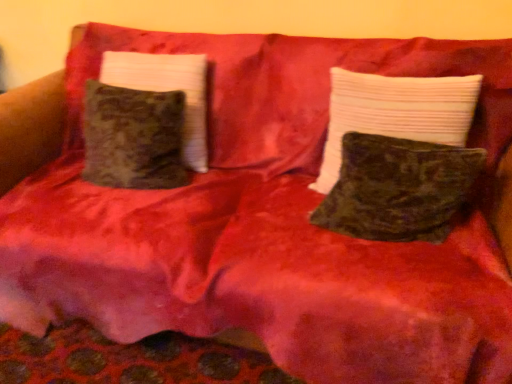
The height and width of the screenshot is (384, 512). Describe the element at coordinates (395, 112) in the screenshot. I see `velvet green pillow at center, the third pillow viewed from the left` at that location.

Image resolution: width=512 pixels, height=384 pixels. What do you see at coordinates (398, 189) in the screenshot?
I see `velvety dark green pillow at center, marked as the second pillow in a left-to-right arrangement` at bounding box center [398, 189].

Where is `velvet green pillow at center, the third pillow viewed from the left`? velvet green pillow at center, the third pillow viewed from the left is located at coordinates (395, 112).

Who is smaller, velvet green pillow at center, the third pillow viewed from the left, or velvet green pillow at left, the first pillow in the left-to-right sequence?

velvet green pillow at center, the third pillow viewed from the left, is smaller.

Can you confirm if velvet green pillow at center, which ranks as the first pillow in right-to-left order, is wider than velvet green pillow at left, the first pillow in the left-to-right sequence?

Incorrect, the width of velvet green pillow at center, which ranks as the first pillow in right-to-left order, does not surpass that of velvet green pillow at left, the first pillow in the left-to-right sequence.

How different are the orientations of velvet green pillow at center, the third pillow viewed from the left, and velvet green pillow at left, the third pillow from the right, in degrees?

The angular difference between velvet green pillow at center, the third pillow viewed from the left, and velvet green pillow at left, the third pillow from the right, is 0.000103 degrees.

From the image's perspective, which object appears higher, velvet green pillow at center, the third pillow viewed from the left, or velvet green pillow at left, the third pillow from the right?

velvet green pillow at left, the third pillow from the right, appears higher in the image.

Does point (398, 157) come in front of point (404, 92)?

Yes, it is.

Can you tell me how much velvety dark green pillow at center, placed as the second pillow when sorted from right to left, and velvet green pillow at center, which ranks as the first pillow in right-to-left order, differ in facing direction?

The angle between the facing direction of velvety dark green pillow at center, placed as the second pillow when sorted from right to left, and the facing direction of velvet green pillow at center, which ranks as the first pillow in right-to-left order, is 0.000139 degrees.

Is velvety dark green pillow at center, placed as the second pillow when sorted from right to left, not close to velvet green pillow at center, which ranks as the first pillow in right-to-left order?

They are positioned close to each other.

Which pillow is the 1st one when counting from the back of the velvety dark green pillow at center, placed as the second pillow when sorted from right to left? Please provide its 2D coordinates.

[(395, 112)]

At what (x,y) coordinates should I click in order to perform the action: click on pillow lying behind the velvet green pillow at center, which ranks as the first pillow in right-to-left order. Please return your answer as a coordinate pair (x, y). Looking at the image, I should click on (165, 78).

Is velvet green pillow at left, the third pillow from the right, situated inside velvet green pillow at center, the third pillow viewed from the left, or outside?

velvet green pillow at left, the third pillow from the right, is located beyond the bounds of velvet green pillow at center, the third pillow viewed from the left.

Considering the sizes of velvet green pillow at left, the first pillow in the left-to-right sequence, and velvet green pillow at center, the third pillow viewed from the left, in the image, is velvet green pillow at left, the first pillow in the left-to-right sequence, bigger or smaller than velvet green pillow at center, the third pillow viewed from the left,?

velvet green pillow at left, the first pillow in the left-to-right sequence, is bigger than velvet green pillow at center, the third pillow viewed from the left.

How much distance is there between velvet green pillow at left, the third pillow from the right, and velvet green pillow at center, which ranks as the first pillow in right-to-left order?

velvet green pillow at left, the third pillow from the right, and velvet green pillow at center, which ranks as the first pillow in right-to-left order, are 25.47 inches apart from each other.

Is velvety dark green pillow at center, marked as the second pillow in a left-to-right arrangement, spatially inside velvet green pillow at left, the first pillow in the left-to-right sequence, or outside of it?

velvety dark green pillow at center, marked as the second pillow in a left-to-right arrangement, lies outside velvet green pillow at left, the first pillow in the left-to-right sequence.

I want to click on pillow that is the 2nd object located behind the velvety dark green pillow at center, placed as the second pillow when sorted from right to left, so click(x=165, y=78).

Is velvety dark green pillow at center, placed as the second pillow when sorted from right to left, turned away from velvet green pillow at left, the first pillow in the left-to-right sequence?

No, velvet green pillow at left, the first pillow in the left-to-right sequence, is not at the back of velvety dark green pillow at center, placed as the second pillow when sorted from right to left.

From the image's perspective, which is below, velvety dark green pillow at center, placed as the second pillow when sorted from right to left, or velvet green pillow at left, the third pillow from the right?

velvety dark green pillow at center, placed as the second pillow when sorted from right to left, is shown below in the image.

Considering the positions of objects velvet green pillow at center, the third pillow viewed from the left, and velvety dark green pillow at center, placed as the second pillow when sorted from right to left, in the image provided, who is more to the left, velvet green pillow at center, the third pillow viewed from the left, or velvety dark green pillow at center, placed as the second pillow when sorted from right to left,?

velvety dark green pillow at center, placed as the second pillow when sorted from right to left.

From a real-world perspective, which is physically below, velvet green pillow at center, the third pillow viewed from the left, or velvety dark green pillow at center, marked as the second pillow in a left-to-right arrangement?

velvety dark green pillow at center, marked as the second pillow in a left-to-right arrangement, is physically lower.

Is point (337, 79) closer to camera compared to point (345, 209)?

No, it is not.

From the image's perspective, which is below, velvet green pillow at center, which ranks as the first pillow in right-to-left order, or velvety dark green pillow at center, placed as the second pillow when sorted from right to left?

From the image's view, velvety dark green pillow at center, placed as the second pillow when sorted from right to left, is below.

Which object is wider, velvet green pillow at left, the first pillow in the left-to-right sequence, or velvety dark green pillow at center, marked as the second pillow in a left-to-right arrangement?

With larger width is velvet green pillow at left, the first pillow in the left-to-right sequence.

From the image's perspective, between velvet green pillow at left, the third pillow from the right, and velvety dark green pillow at center, placed as the second pillow when sorted from right to left, which one is located above?

velvet green pillow at left, the third pillow from the right, is shown above in the image.

Is point (199, 108) in front of point (380, 159)?

No, (199, 108) is behind (380, 159).

Would you say velvet green pillow at left, the third pillow from the right, is a long distance from velvety dark green pillow at center, placed as the second pillow when sorted from right to left?

No, velvet green pillow at left, the third pillow from the right, is in close proximity to velvety dark green pillow at center, placed as the second pillow when sorted from right to left.

Where is `pillow that is above the velvet green pillow at center, which ranks as the first pillow in right-to-left order (from the image's perspective)`? The image size is (512, 384). pillow that is above the velvet green pillow at center, which ranks as the first pillow in right-to-left order (from the image's perspective) is located at coordinates (165, 78).

Which pillow is the 1st one when counting from the left side of the velvet green pillow at center, which ranks as the first pillow in right-to-left order? Please provide its 2D coordinates.

[(398, 189)]

Which object lies further to the anchor point velvet green pillow at center, the third pillow viewed from the left, velvety dark green pillow at center, marked as the second pillow in a left-to-right arrangement, or velvet green pillow at left, the first pillow in the left-to-right sequence?

velvet green pillow at left, the first pillow in the left-to-right sequence, is positioned further to the anchor velvet green pillow at center, the third pillow viewed from the left.

Looking at the image, which one is located closer to velvety dark green pillow at center, placed as the second pillow when sorted from right to left, velvet green pillow at center, which ranks as the first pillow in right-to-left order, or velvet green pillow at left, the third pillow from the right?

velvet green pillow at center, which ranks as the first pillow in right-to-left order, is positioned closer to the anchor velvety dark green pillow at center, placed as the second pillow when sorted from right to left.

Considering their positions, is velvet green pillow at left, the first pillow in the left-to-right sequence, positioned further to velvety dark green pillow at center, placed as the second pillow when sorted from right to left, than velvet green pillow at center, which ranks as the first pillow in right-to-left order?

Based on the image, velvet green pillow at left, the first pillow in the left-to-right sequence, appears to be further to velvety dark green pillow at center, placed as the second pillow when sorted from right to left.

From the image, which object appears to be farther from velvet green pillow at left, the third pillow from the right, velvet green pillow at center, which ranks as the first pillow in right-to-left order, or velvety dark green pillow at center, placed as the second pillow when sorted from right to left?

velvety dark green pillow at center, placed as the second pillow when sorted from right to left, is positioned further to the anchor velvet green pillow at left, the third pillow from the right.

Looking at the image, which one is located closer to velvet green pillow at center, the third pillow viewed from the left, velvet green pillow at left, the first pillow in the left-to-right sequence, or velvety dark green pillow at center, marked as the second pillow in a left-to-right arrangement?

velvety dark green pillow at center, marked as the second pillow in a left-to-right arrangement, is closer to velvet green pillow at center, the third pillow viewed from the left.

When comparing their distances from velvet green pillow at left, the third pillow from the right, does velvety dark green pillow at center, marked as the second pillow in a left-to-right arrangement, or velvet green pillow at center, which ranks as the first pillow in right-to-left order, seem closer?

velvet green pillow at center, which ranks as the first pillow in right-to-left order, is closer to velvet green pillow at left, the third pillow from the right.

At what (x,y) coordinates should I click in order to perform the action: click on pillow situated between velvet green pillow at left, the first pillow in the left-to-right sequence, and velvet green pillow at center, the third pillow viewed from the left, from left to right. Please return your answer as a coordinate pair (x, y). Looking at the image, I should click on (398, 189).